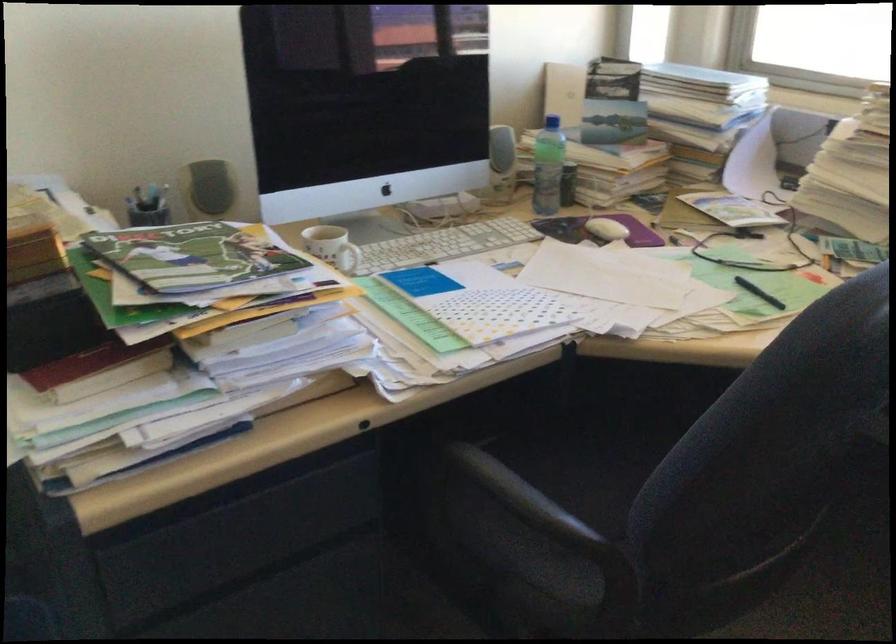
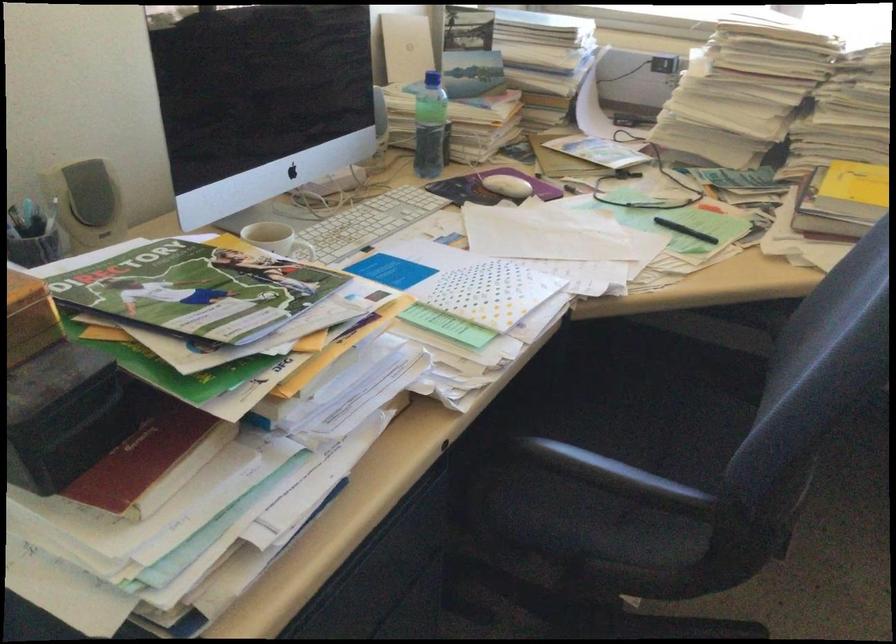
Find the pixel in the second image that matches (x=539, y=164) in the first image.

(428, 126)